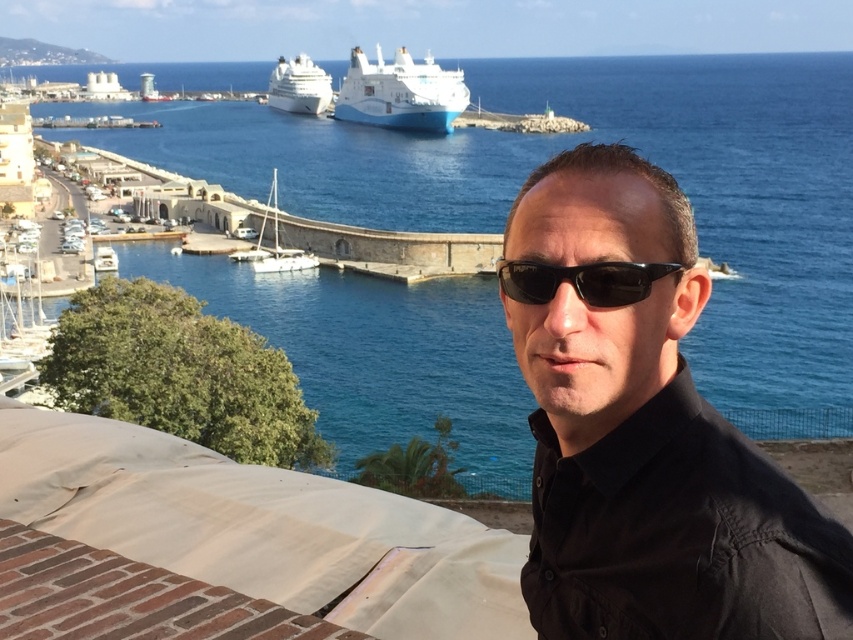
Question: Considering the relative positions of white glossy cruise ship at upper center and white matte sailboat at center in the image provided, where is white glossy cruise ship at upper center located with respect to white matte sailboat at center?

Choices:
 (A) above
 (B) below

Answer: (A)

Question: Can you confirm if black matte shirt at center is positioned below white glossy cruise ship at center?

Choices:
 (A) yes
 (B) no

Answer: (A)

Question: Is blue water at center below black matte shirt at center?

Choices:
 (A) no
 (B) yes

Answer: (A)

Question: Which object is the closest to the white matte sailboat at center?

Choices:
 (A) black matte shirt at center
 (B) black plastic sunglasses at center

Answer: (A)

Question: Which of the following is the closest to the observer?

Choices:
 (A) (376, 88)
 (B) (543, 269)
 (C) (300, 74)
 (D) (306, 264)

Answer: (B)

Question: Among these points, which one is nearest to the camera?

Choices:
 (A) (326, 77)
 (B) (457, 131)
 (C) (257, 241)
 (D) (370, 113)

Answer: (C)